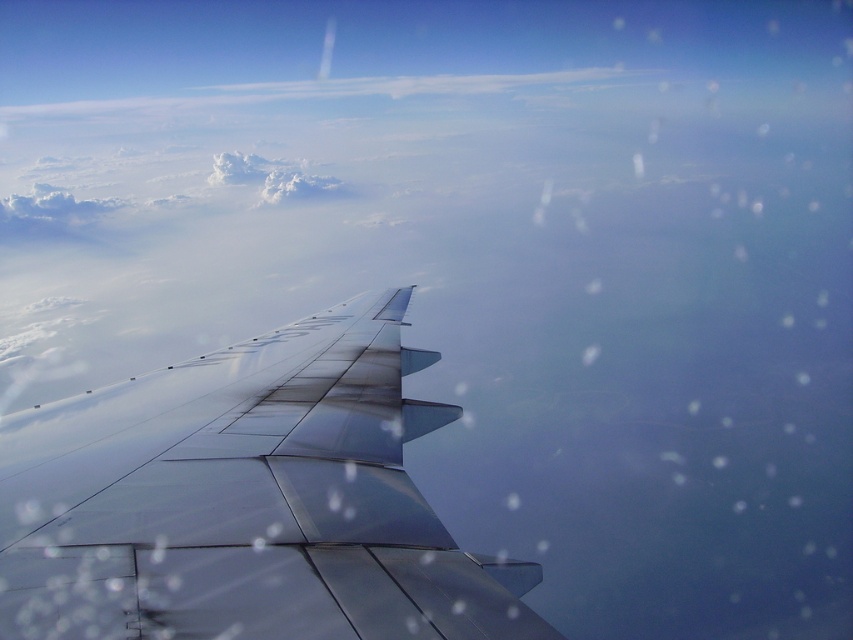
Is metallic silver wing at lower left wider than white fluffy cloud at upper center?

No, metallic silver wing at lower left is not wider than white fluffy cloud at upper center.

Is metallic silver wing at lower left to the left of white fluffy cloud at upper center from the viewer's perspective?

In fact, metallic silver wing at lower left is to the right of white fluffy cloud at upper center.

At what (x,y) coordinates should I click in order to perform the action: click on metallic silver wing at lower left. Please return your answer as a coordinate pair (x, y). Looking at the image, I should click on (247, 500).